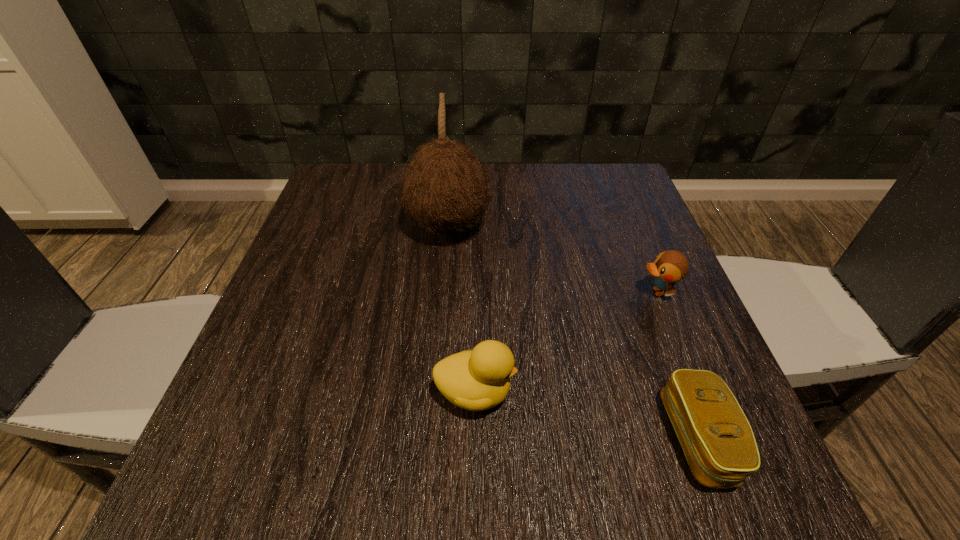
Find the location of a particular element. free space between the shorter duck and the tallest object is located at coordinates pyautogui.click(x=553, y=259).

Identify the location of free point between the taller duck and the shortest object. Image resolution: width=960 pixels, height=540 pixels. (587, 416).

Image resolution: width=960 pixels, height=540 pixels. In order to click on vacant space that is in between the coconut and the clutch bag in this screenshot , I will do `click(573, 333)`.

Find the location of a particular element. The height and width of the screenshot is (540, 960). unoccupied position between the clutch bag and the third nearest object is located at coordinates (678, 365).

Image resolution: width=960 pixels, height=540 pixels. In order to click on vacant area that lies between the shortest object and the farther duck in this screenshot , I will do [678, 365].

The height and width of the screenshot is (540, 960). Find the location of `free point between the farther duck and the farthest object`. free point between the farther duck and the farthest object is located at coordinates (553, 259).

The width and height of the screenshot is (960, 540). Identify the location of vacant area between the right duck and the clutch bag. 678,365.

Image resolution: width=960 pixels, height=540 pixels. Identify the location of the second closest object to the shorter duck. (479, 379).

The height and width of the screenshot is (540, 960). What are the coordinates of `object that can be found as the second closest to the second farthest object` in the screenshot? It's located at (479, 379).